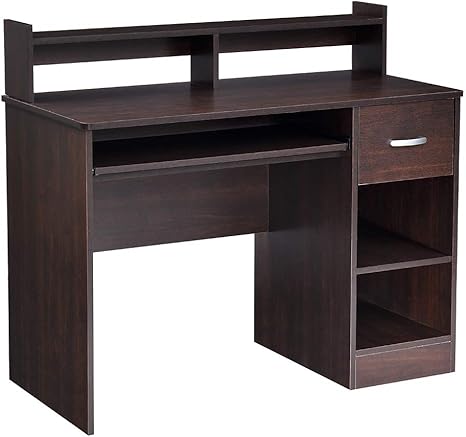
Find the location of a particular element. The image size is (466, 437). dark wooden desk is located at coordinates (253, 144).